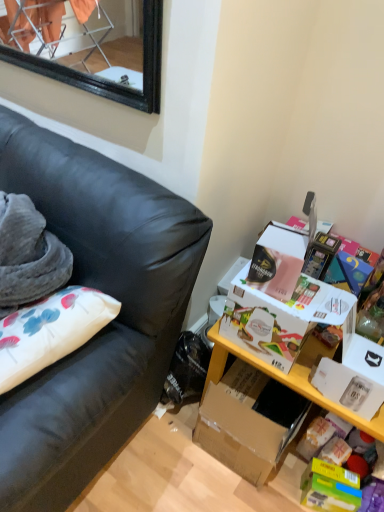
Question: Does black leather couch at left come behind white cardboard box at right?

Choices:
 (A) yes
 (B) no

Answer: (B)

Question: Is black leather couch at left far from white cardboard box at right?

Choices:
 (A) no
 (B) yes

Answer: (A)

Question: Is white cardboard box at right located within black leather couch at left?

Choices:
 (A) yes
 (B) no

Answer: (B)

Question: Is black leather couch at left shorter than white cardboard box at right?

Choices:
 (A) no
 (B) yes

Answer: (A)

Question: Is black leather couch at left smaller than white cardboard box at right?

Choices:
 (A) yes
 (B) no

Answer: (B)

Question: Is black leather couch at left to the right of white cardboard box at right from the viewer's perspective?

Choices:
 (A) no
 (B) yes

Answer: (A)

Question: Considering the relative sizes of yellow wood table at lower right and black leather couch at left in the image provided, is yellow wood table at lower right wider than black leather couch at left?

Choices:
 (A) yes
 (B) no

Answer: (B)

Question: Can you confirm if yellow wood table at lower right is thinner than black leather couch at left?

Choices:
 (A) yes
 (B) no

Answer: (A)

Question: Is yellow wood table at lower right positioned before black leather couch at left?

Choices:
 (A) no
 (B) yes

Answer: (A)

Question: Is yellow wood table at lower right looking in the opposite direction of black leather couch at left?

Choices:
 (A) yes
 (B) no

Answer: (B)

Question: From the image's perspective, is yellow wood table at lower right over black leather couch at left?

Choices:
 (A) yes
 (B) no

Answer: (B)

Question: Is black leather couch at left a part of yellow wood table at lower right?

Choices:
 (A) yes
 (B) no

Answer: (B)

Question: Is yellow wood table at lower right at the back of black leather couch at left?

Choices:
 (A) yes
 (B) no

Answer: (B)